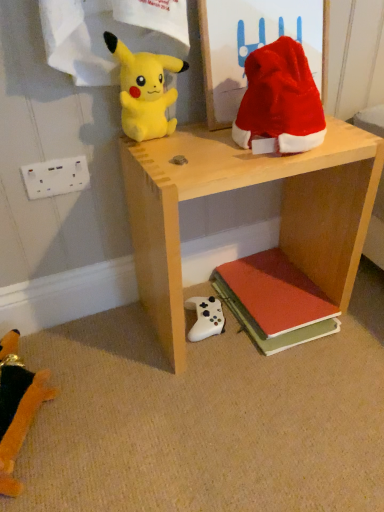
Where is `free space in front of yellow plush toy at upper left, the second toy when ordered from left to right`? The width and height of the screenshot is (384, 512). free space in front of yellow plush toy at upper left, the second toy when ordered from left to right is located at coordinates (181, 153).